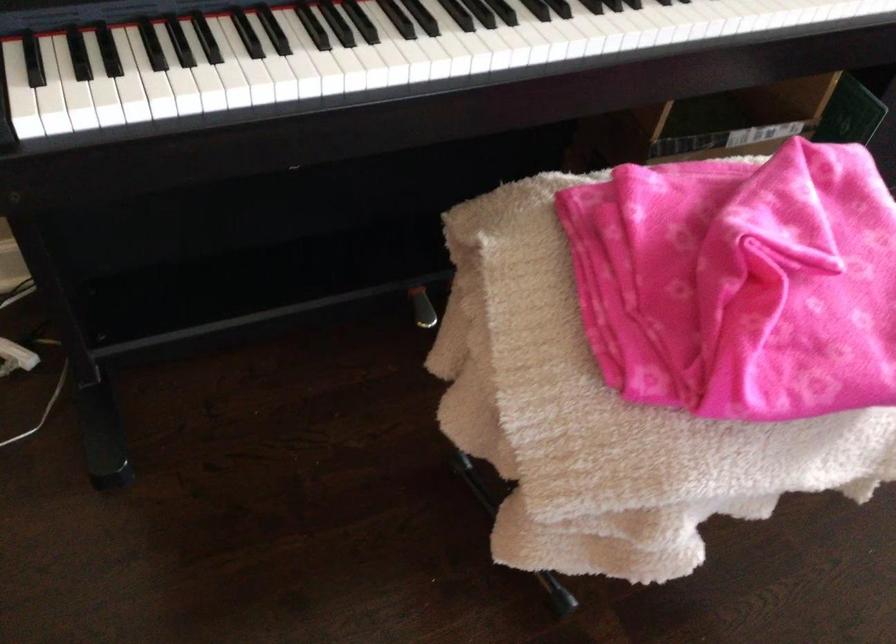
Find where to press the piano sustain pedal. Please return your answer as a coordinate pair (x, y).

(421, 308)